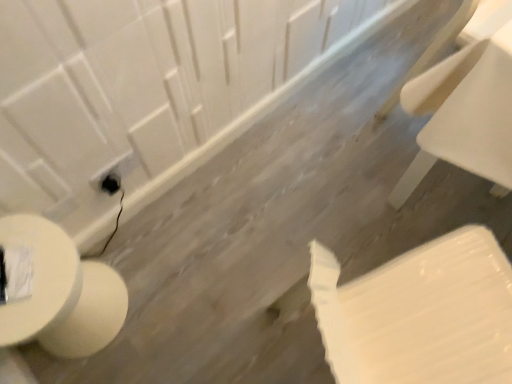
At what (x,y) coordinates should I click in order to perform the action: click on space that is in front of white plastic chair at upper right. Please return your answer as a coordinate pair (x, y). Image resolution: width=512 pixels, height=384 pixels. Looking at the image, I should click on (421, 192).